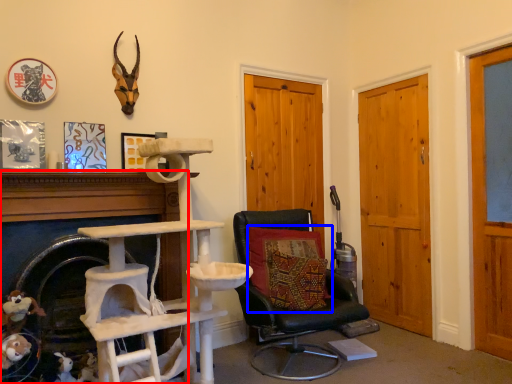
Question: Among these objects, which one is farthest to the camera, fireplace (highlighted by a red box) or pillow (highlighted by a blue box)?

Choices:
 (A) fireplace
 (B) pillow

Answer: (B)